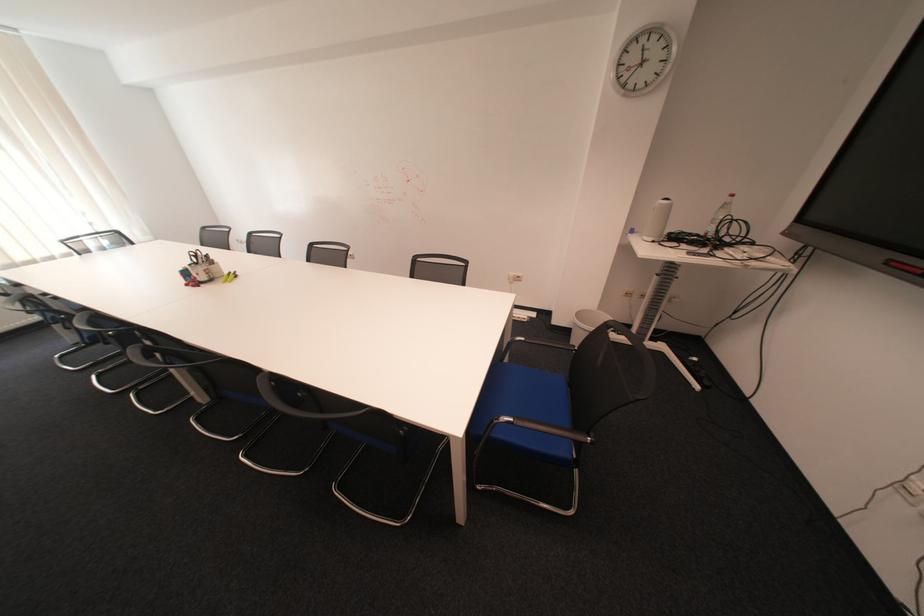
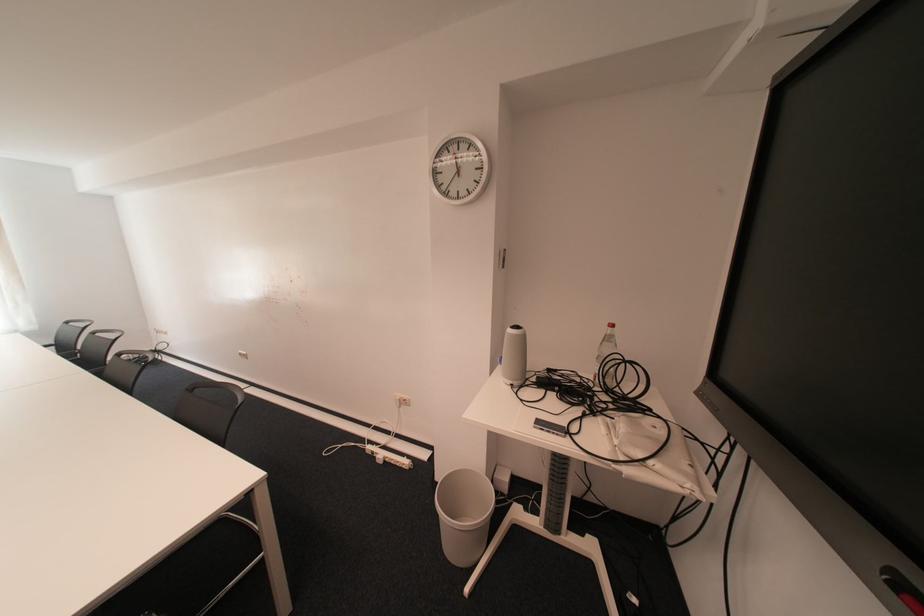
Find the pixel in the second image that matches (663,240) in the first image.

(520, 383)